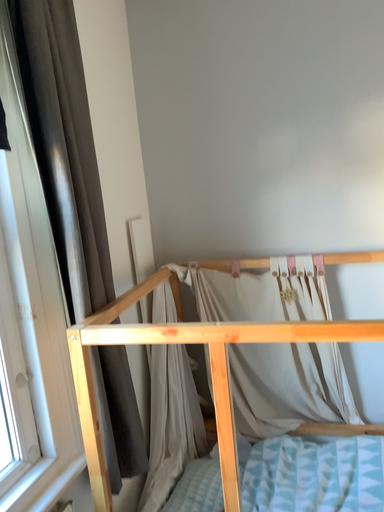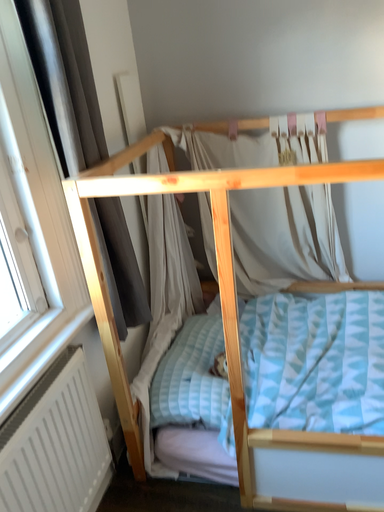
Question: Which way did the camera rotate in the video?

Choices:
 (A) rotated upward
 (B) rotated downward

Answer: (B)